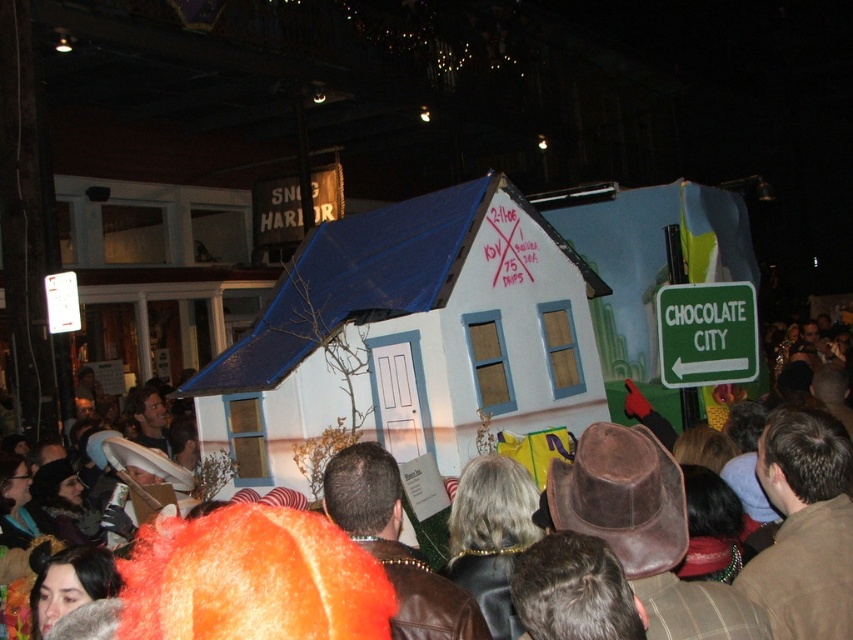
You are a participant in the parade and want to place a decorative ribbon on the brown leather hat at center. According to the coordinates provided, where exactly should you aim to place the ribbon?

The brown leather hat at center is located at point (788, 540), so you should aim for those coordinates to place the ribbon accurately.

You are a photographer at the event and want to capture both the brown leather hat at center and the green plastic sign at right in a single shot. Based on their positions, will you need to adjust your camera angle upwards or downwards to include both in the frame?

The brown leather hat at center is below the green plastic sign at right, so you will need to adjust your camera angle upwards to include both in the frame.

You are a participant in the parade and you notice two items in the scene. One is a brown leather hat at center and the other is a green plastic sign at right. Which of these two items is larger in size?

The brown leather hat at center is bigger than the green plastic sign at right.